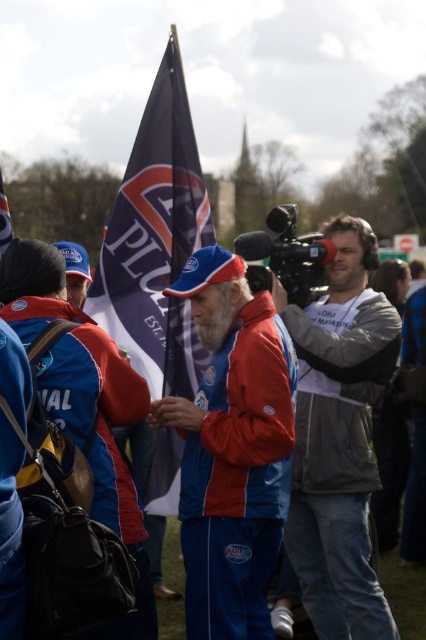
Is blue fabric flag at center to the left of blue fabric flag at upper center from the viewer's perspective?

No, blue fabric flag at center is not to the left of blue fabric flag at upper center.

Where is `blue fabric flag at center`? The image size is (426, 640). blue fabric flag at center is located at coordinates (155, 241).

This screenshot has height=640, width=426. I want to click on blue fabric flag at center, so click(155, 241).

Does blue fabric santa claus at center appear under red jacket at center?

Yes.

Is the position of blue fabric santa claus at center less distant than that of red jacket at center?

Yes, it is in front of red jacket at center.

Where is `blue fabric santa claus at center`? The height and width of the screenshot is (640, 426). blue fabric santa claus at center is located at coordinates (232, 449).

Locate an element on the screen. This screenshot has width=426, height=640. blue fabric santa claus at center is located at coordinates (232, 449).

Can you confirm if blue fabric santa claus at center is shorter than blue fabric flag at center?

Yes.

Between point (207, 467) and point (152, 502), which one is positioned in front?

Positioned in front is point (207, 467).

Find the location of a particular element. blue fabric santa claus at center is located at coordinates (232, 449).